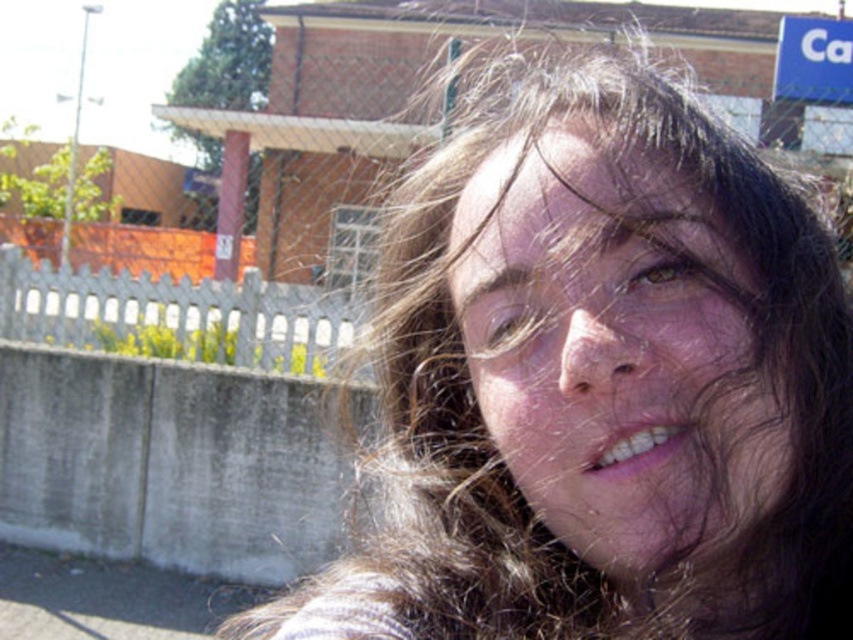
Question: Which of the following is the closest to the observer?

Choices:
 (A) smooth skin face at center
 (B) blue plastic sign at upper right

Answer: (A)

Question: Can you confirm if smooth skin face at center is thinner than blue plastic sign at upper right?

Choices:
 (A) yes
 (B) no

Answer: (A)

Question: Can you confirm if brown hair at center is positioned above blue plastic sign at upper right?

Choices:
 (A) yes
 (B) no

Answer: (B)

Question: Among these objects, which one is nearest to the camera?

Choices:
 (A) brown hair at center
 (B) smooth skin face at center
 (C) blue plastic sign at upper right

Answer: (B)

Question: Estimate the real-world distances between objects in this image. Which object is farther from the brown hair at center?

Choices:
 (A) smooth skin face at center
 (B) blue plastic sign at upper right

Answer: (B)

Question: Is smooth skin face at center above blue plastic sign at upper right?

Choices:
 (A) no
 (B) yes

Answer: (A)